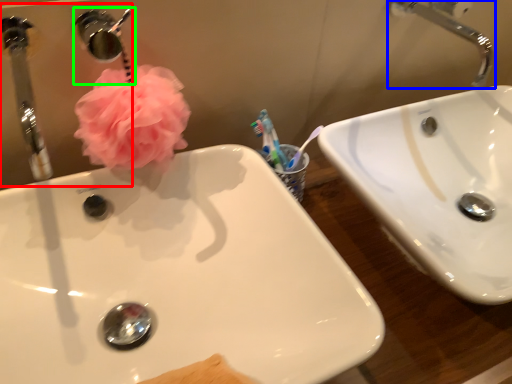
Question: Which is farther away from mirror (highlighted by a red box)? tap (highlighted by a blue box) or plumbing fixture (highlighted by a green box)?

Choices:
 (A) tap
 (B) plumbing fixture

Answer: (B)